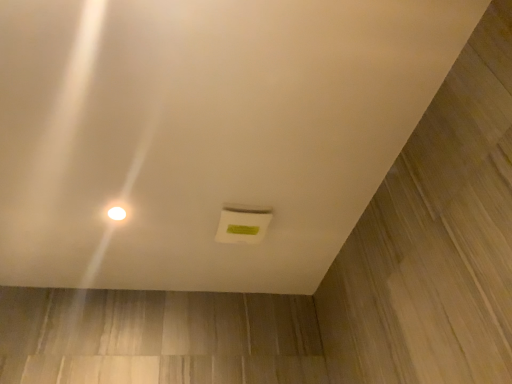
Locate an element on the screen. The image size is (512, 384). free location to the left of white glossy light bulb at upper left is located at coordinates (58, 217).